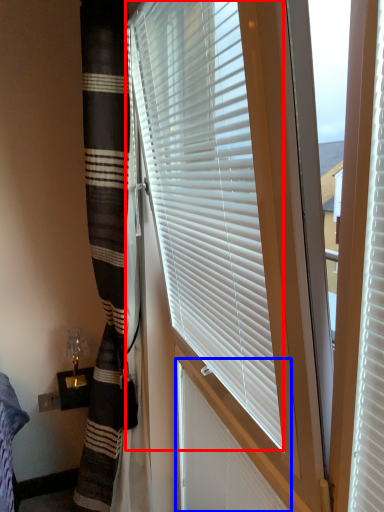
Question: Which object appears farthest to the camera in this image, window blind (highlighted by a red box) or shutter (highlighted by a blue box)?

Choices:
 (A) window blind
 (B) shutter

Answer: (B)